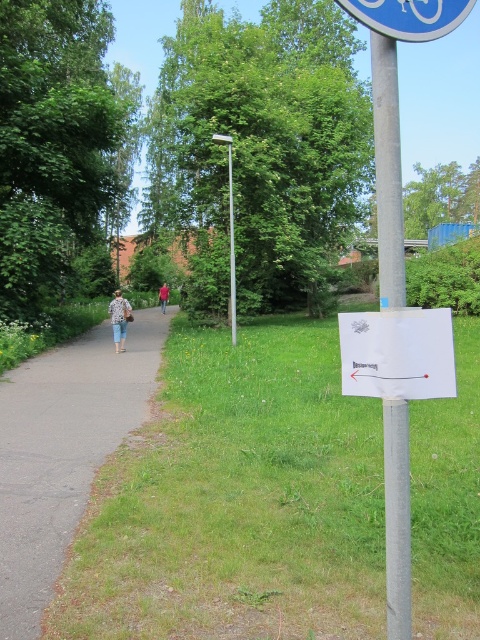
Question: Considering the relative positions of blue plastic sign at upper center and floral-patterned blouse at center in the image provided, where is blue plastic sign at upper center located with respect to floral-patterned blouse at center?

Choices:
 (A) above
 (B) below

Answer: (A)

Question: Which point is closer to the camera taking this photo?

Choices:
 (A) (166, 291)
 (B) (433, 3)
 (C) (57, 410)
 (D) (116, 352)

Answer: (B)

Question: Is green grass at lower left positioned behind blue plastic sign at upper center?

Choices:
 (A) yes
 (B) no

Answer: (A)

Question: Is the position of white paper sign at center less distant than that of blue plastic sign at upper center?

Choices:
 (A) no
 (B) yes

Answer: (A)

Question: Among these objects, which one is nearest to the camera?

Choices:
 (A) green grass at lower left
 (B) white paper sign at center
 (C) light brown leather jacket at center

Answer: (B)

Question: Which point is closer to the camera?

Choices:
 (A) (167, 289)
 (B) (152, 336)
 (C) (395, 534)

Answer: (C)